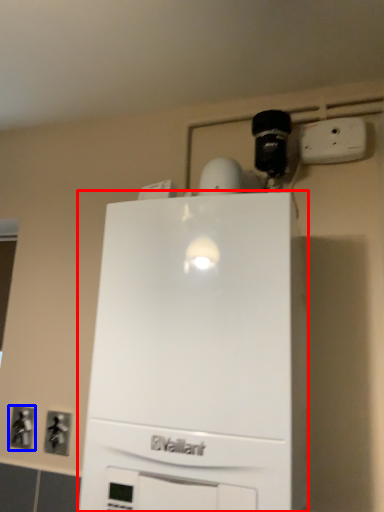
Question: Among these objects, which one is nearest to the camera, home appliance (highlighted by a red box) or electric outlet (highlighted by a blue box)?

Choices:
 (A) home appliance
 (B) electric outlet

Answer: (A)